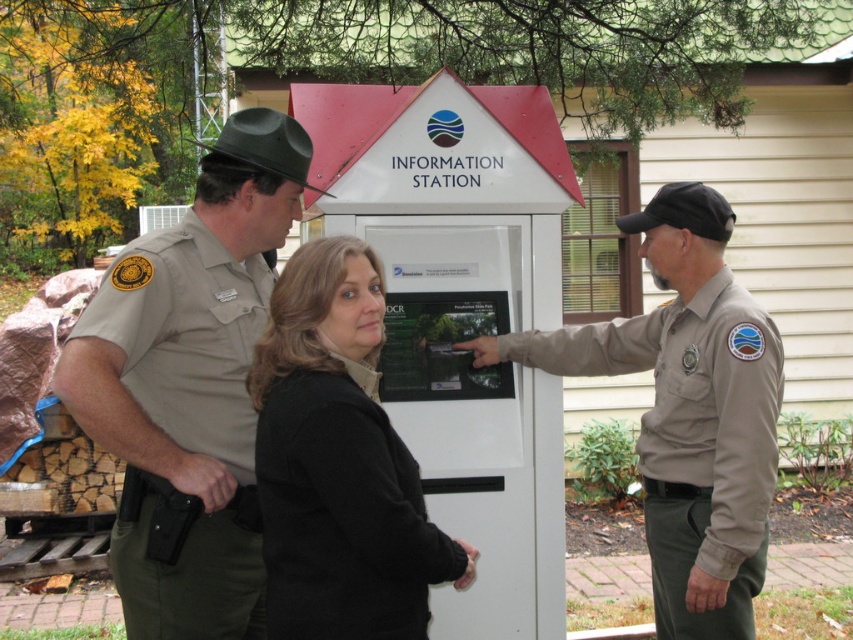
What is the coordinate of the black leather jacket at center?

The black leather jacket at center is located at coordinate point (531, 408).

You are a photographer trying to capture a clear photo of the two jackets worn by the individuals in the center. Since both jackets are black, how can you distinguish the black leather jacket at center from the black fleece jacket at center in your photo?

The black leather jacket at center is larger in size than the black fleece jacket at center, so you can distinguish them by their size difference.